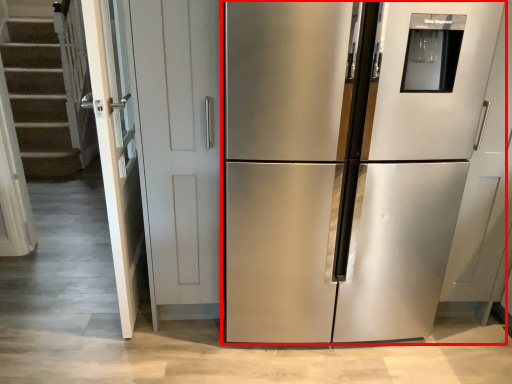
Question: From the image, what is the correct spatial relationship of refrigerator (annotated by the red box) in relation to door?

Choices:
 (A) left
 (B) right

Answer: (B)